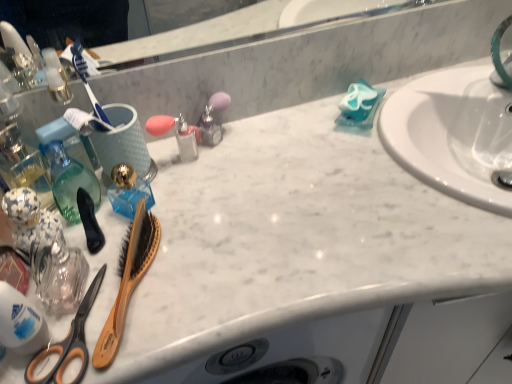
Identify the location of vacant space that's between blue matte soap at upper right, the second cleaning product from the bottom, and black rubber brush at left, which is the first brush in left-to-right order. (258, 164).